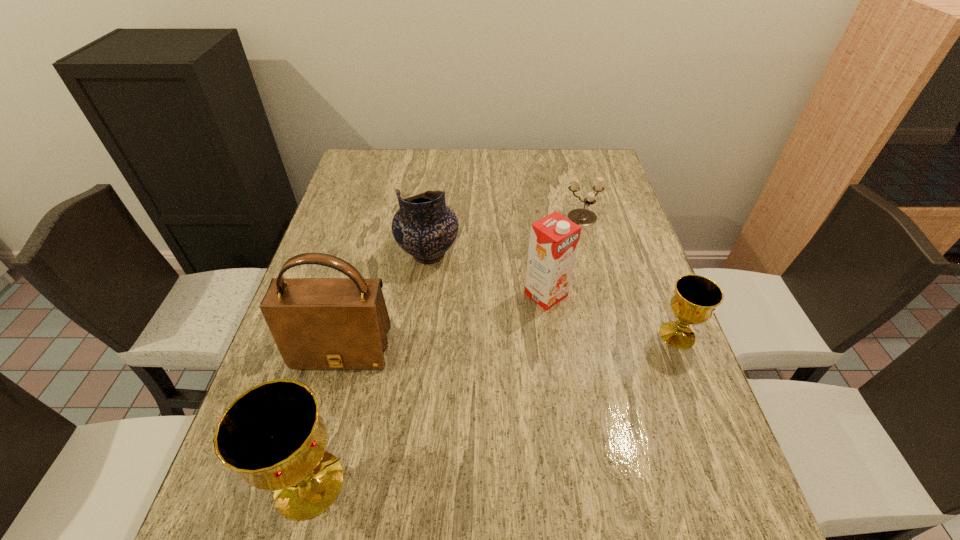
Image resolution: width=960 pixels, height=540 pixels. In order to click on free space located on the right of the nearer chalice in this screenshot , I will do `click(418, 484)`.

You are a GUI agent. You are given a task and a screenshot of the screen. Output one action in this format:
    pyautogui.click(x=<x>, y=<y>)
    Task: Click on the free location located 0.260m on the front of the shorter chalice
    This screenshot has height=540, width=960.
    Given the screenshot: What is the action you would take?
    pyautogui.click(x=732, y=472)

Locate an element on the screen. The width and height of the screenshot is (960, 540). vacant space located on the left of the second farthest object is located at coordinates (368, 254).

Identify the location of free point located 0.350m on the back of the candle holder. The height and width of the screenshot is (540, 960). (564, 151).

This screenshot has width=960, height=540. I want to click on vacant space situated 0.230m on the front of the fourth nearest object, so click(561, 397).

Locate an element on the screen. The width and height of the screenshot is (960, 540). vacant space located 0.210m on the front flap of the shoulder bag is located at coordinates (309, 474).

The height and width of the screenshot is (540, 960). I want to click on object at the near edge, so click(x=272, y=435).

The image size is (960, 540). Identify the location of chalice located in the left edge section of the desktop. (272, 435).

Locate an element on the screen. Image resolution: width=960 pixels, height=540 pixels. shoulder bag located at the left edge is located at coordinates (317, 323).

Find the location of a particular element. The image size is (960, 540). chalice positioned at the right edge is located at coordinates (695, 297).